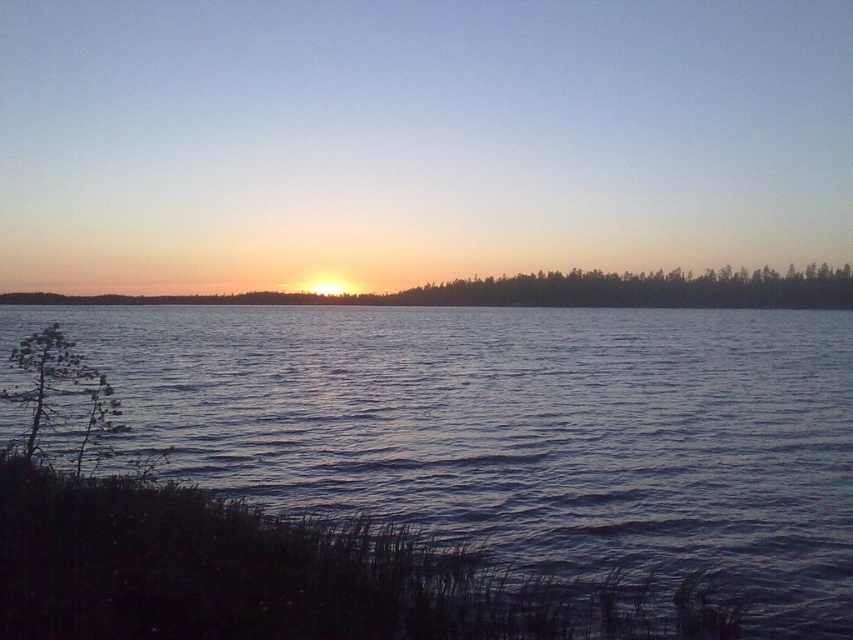
Question: Which point appears closest to the camera in this image?

Choices:
 (A) (45, 339)
 (B) (212, 65)

Answer: (A)

Question: From the image, what is the correct spatial relationship of orange sky at horizon in relation to dark blue water at center?

Choices:
 (A) below
 (B) above

Answer: (B)

Question: Is dark blue water at center further to camera compared to green matte tree at lower left?

Choices:
 (A) yes
 (B) no

Answer: (B)

Question: Estimate the real-world distances between objects in this image. Which object is closer to the green matte tree at center?

Choices:
 (A) orange sky at horizon
 (B) dark blue water at center

Answer: (A)

Question: Is orange sky at horizon to the left of dark blue water at center from the viewer's perspective?

Choices:
 (A) no
 (B) yes

Answer: (B)

Question: Which of the following is the closest to the observer?

Choices:
 (A) (256, 244)
 (B) (740, 272)
 (C) (73, 456)
 (D) (786, 552)

Answer: (D)